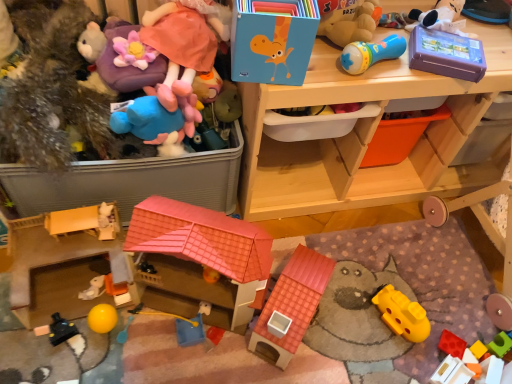
At what (x,y) coordinates should I click in order to perform the action: click on free space between black plastic toy at lower left, the 13th toy viewed from the right, and white plastic toy at lower right, arranged as the 3th toy when viewed from the right. Please return your answer as a coordinate pair (x, y). The image size is (512, 384). Looking at the image, I should click on (256, 357).